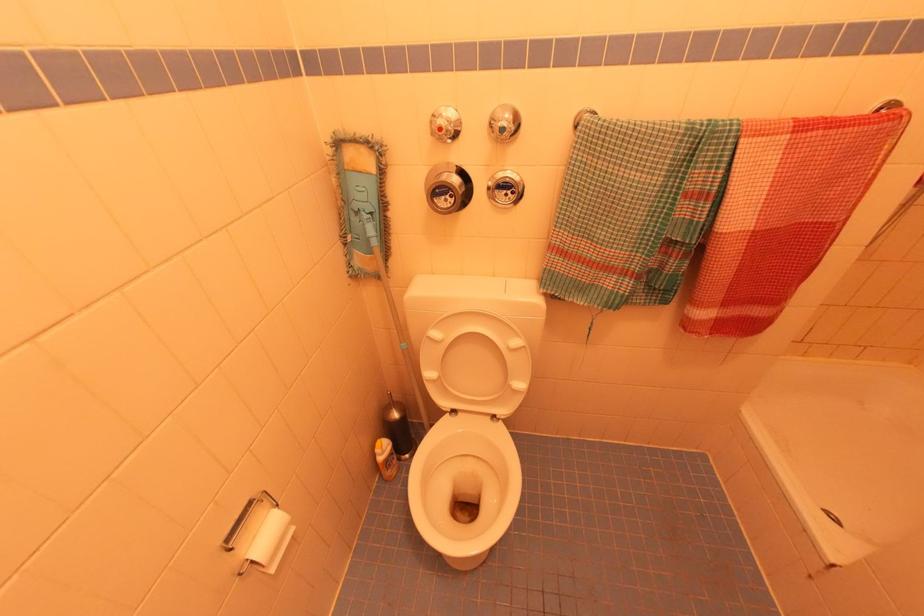
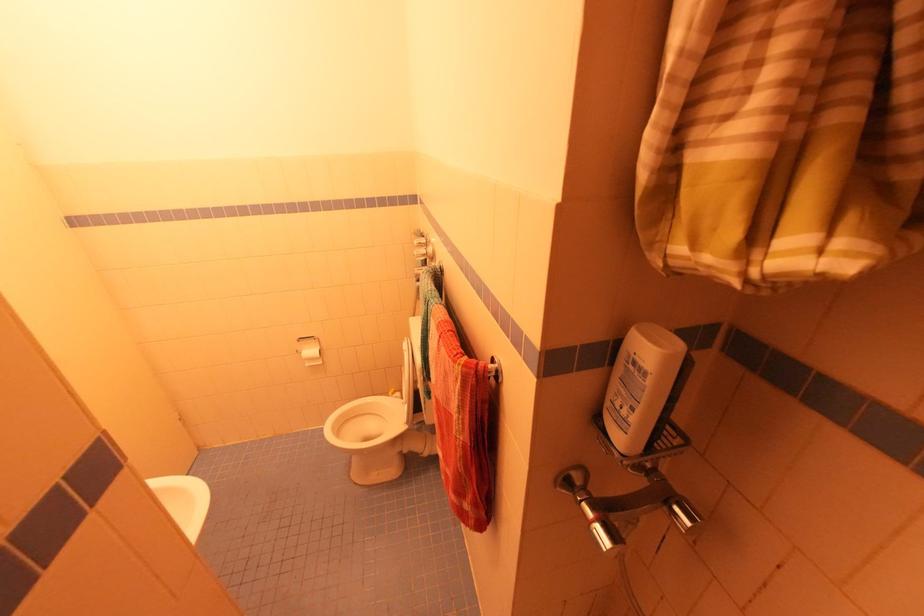
Where in the second image is the point corresponding to the point at 253,503 from the first image?

(314, 338)